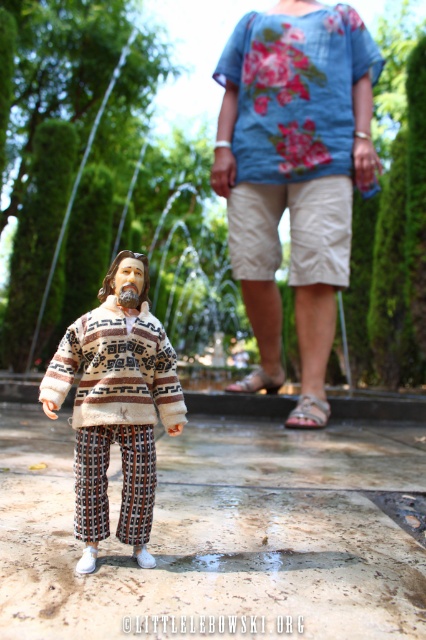
Question: Does floral cotton shirt at upper center have a greater width compared to white wool sweater at center?

Choices:
 (A) no
 (B) yes

Answer: (B)

Question: Does blue floral fabric shirt at upper center appear over patterned fabric pants at center?

Choices:
 (A) no
 (B) yes

Answer: (B)

Question: Does white wool sweater at center have a smaller size compared to patterned fabric pants at center?

Choices:
 (A) yes
 (B) no

Answer: (B)

Question: Among these points, which one is farthest from the camera?

Choices:
 (A) (60, 349)
 (B) (48, 396)
 (C) (138, 531)
 (D) (313, 253)

Answer: (D)

Question: Among these points, which one is farthest from the camera?

Choices:
 (A) (244, 80)
 (B) (141, 518)
 (C) (256, 308)
 (D) (123, 378)

Answer: (C)

Question: Estimate the real-world distances between objects in this image. Which object is closer to the blue floral fabric shirt at upper center?

Choices:
 (A) floral cotton shirt at upper center
 (B) patterned fabric pants at center

Answer: (A)